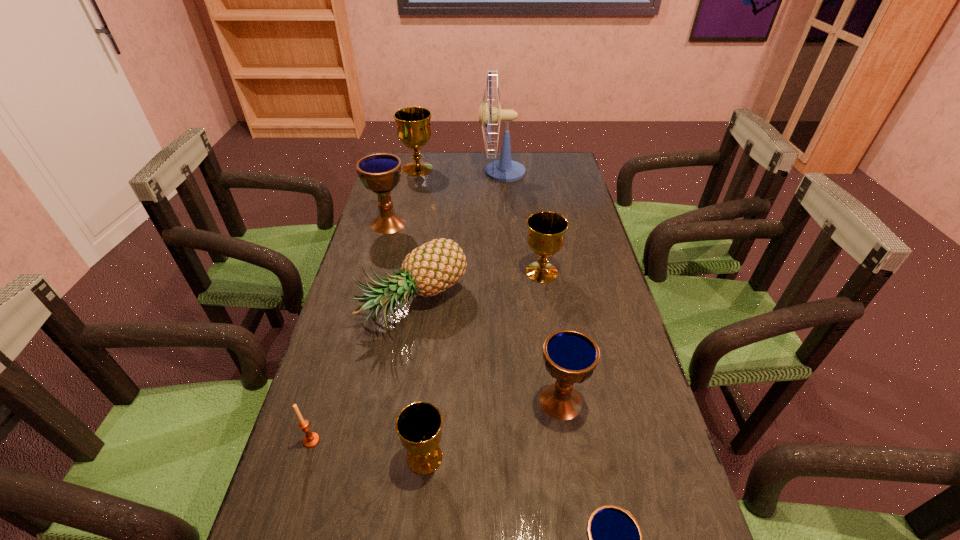
Locate an element on the screen. the tallest object is located at coordinates (504, 170).

Where is `fan`? This screenshot has height=540, width=960. fan is located at coordinates (504, 170).

Locate an element on the screen. the farthest gold chalice is located at coordinates (413, 123).

At what (x,y) coordinates should I click in order to perform the action: click on the farthest chalice. Please return your answer as a coordinate pair (x, y). The width and height of the screenshot is (960, 540). Looking at the image, I should click on (413, 123).

Identify the location of the farthest blue chalice. The image size is (960, 540). (381, 172).

The image size is (960, 540). Find the location of `the biggest blue chalice`. the biggest blue chalice is located at coordinates (381, 172).

Locate an element on the screen. This screenshot has width=960, height=540. the fourth nearest chalice is located at coordinates (545, 237).

At what (x,y) coordinates should I click in order to perform the action: click on the second nearest gold chalice. Please return your answer as a coordinate pair (x, y). This screenshot has width=960, height=540. Looking at the image, I should click on (545, 237).

Where is `the fourth farthest chalice`? the fourth farthest chalice is located at coordinates (570, 356).

Identify the location of the second farthest blue chalice. (570, 356).